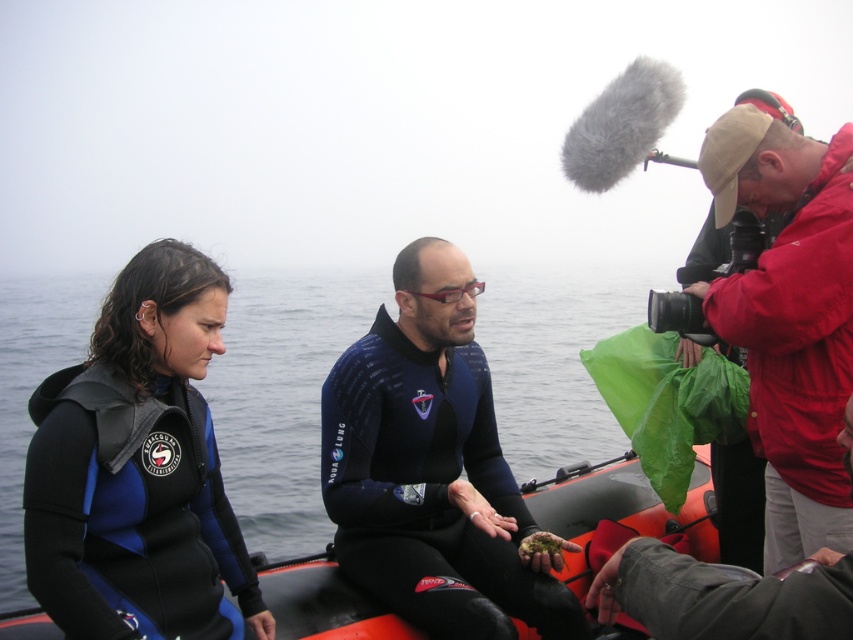
Who is more distant from viewer, (99,595) or (352,620)?

Positioned behind is point (352,620).

Does blue matte wetsuit at left have a lesser width compared to rubber boat at center?

Correct, blue matte wetsuit at left's width is less than rubber boat at center's.

Between point (160, 611) and point (38, 636), which one is positioned in front?

Positioned in front is point (160, 611).

The width and height of the screenshot is (853, 640). Identify the location of blue matte wetsuit at left. (138, 468).

Can you confirm if red jacket at upper right is wider than red matte jacket at upper right?

Result: Incorrect, red jacket at upper right's width does not surpass red matte jacket at upper right's.

Is red jacket at upper right in front of red matte jacket at upper right?

That is False.

Between point (733, 134) and point (735, 604), which one is positioned in front?

Positioned in front is point (735, 604).

Locate an element on the screen. red jacket at upper right is located at coordinates (788, 317).

Between blue neoprene wetsuit at center and red jacket at upper right, which one is positioned lower?

blue neoprene wetsuit at center is lower down.

Who is more distant from viewer, (x=457, y=314) or (x=833, y=456)?

The point (x=457, y=314) is more distant.

Is point (505, 465) closer to viewer compared to point (751, 179)?

No, it is behind (751, 179).

Locate an element on the screen. This screenshot has width=853, height=640. blue neoprene wetsuit at center is located at coordinates (432, 468).